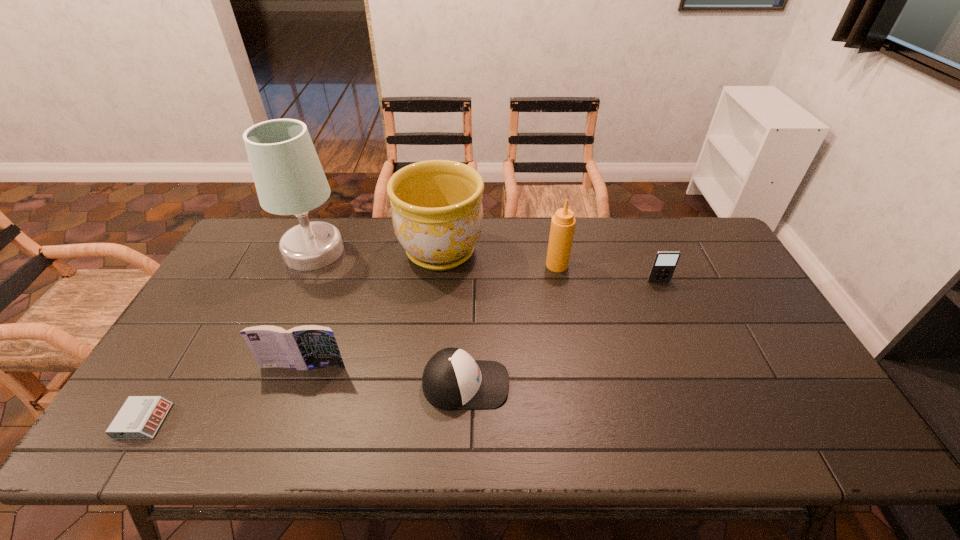
Locate an element on the screen. The width and height of the screenshot is (960, 540). free space between the tallest object and the fourth shortest object is located at coordinates (309, 309).

Locate an element on the screen. The width and height of the screenshot is (960, 540). blank region between the lampshade and the book is located at coordinates (309, 309).

Find the location of a particular element. vacant area that lies between the shortest object and the condiment is located at coordinates pos(350,343).

You are a GUI agent. You are given a task and a screenshot of the screen. Output one action in this format:
    pyautogui.click(x=<x>, y=<y>)
    Task: Click on the free point between the cap and the rightmost object
    
    Given the screenshot: What is the action you would take?
    [563, 333]

Locate an element on the screen. This screenshot has height=540, width=960. free space between the cap and the second object from right to left is located at coordinates (512, 325).

Where is `free space between the flowerpot and the condiment`? The width and height of the screenshot is (960, 540). free space between the flowerpot and the condiment is located at coordinates (499, 258).

Select which object appears as the sixth closest to the condiment. Please provide its 2D coordinates. Your answer should be formatted as a tuple, i.e. [(x, y)], where the tuple contains the x and y coordinates of a point satisfying the conditions above.

[(140, 417)]

Locate which object is the second closest to the flowerpot. Please provide its 2D coordinates. Your answer should be formatted as a tuple, i.e. [(x, y)], where the tuple contains the x and y coordinates of a point satisfying the conditions above.

[(563, 222)]

At what (x,y) coordinates should I click in order to perform the action: click on vacant space that satisfies the following two spatial constraints: 1. on the front panel of the cap; 2. on the front side of the shortest object. Please return your answer as a coordinate pair (x, y). Looking at the image, I should click on (465, 421).

Locate an element on the screen. The image size is (960, 540). vacant space that satisfies the following two spatial constraints: 1. on the front-facing side of the iPod; 2. on the front panel of the cap is located at coordinates (703, 384).